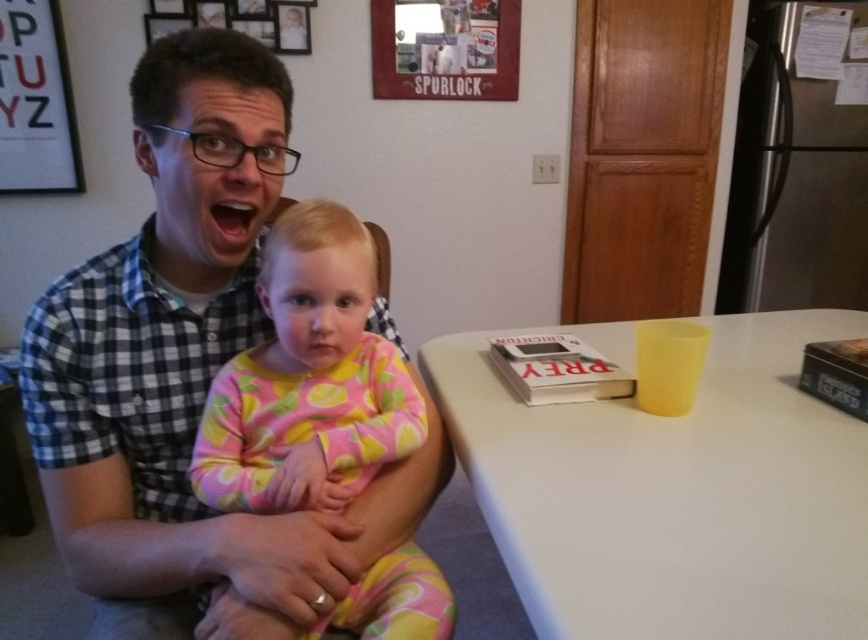
This screenshot has height=640, width=868. What do you see at coordinates (672, 490) in the screenshot? I see `white matte table at center` at bounding box center [672, 490].

Does point (540, 449) come in front of point (217, 440)?

No, (540, 449) is behind (217, 440).

Where is `white matte table at center`? This screenshot has width=868, height=640. white matte table at center is located at coordinates (672, 490).

Who is higher up, checkered fabric shirt at upper left or pink floral pajamas at center?

checkered fabric shirt at upper left

You are a GUI agent. You are given a task and a screenshot of the screen. Output one action in this format:
    pyautogui.click(x=<x>, y=<y>)
    Task: Click on the checkered fabric shirt at upper left
    This screenshot has width=868, height=640.
    Given the screenshot: What is the action you would take?
    pyautogui.click(x=188, y=376)

Is point (169, 563) in front of point (579, 456)?

Yes, it is in front of point (579, 456).

Who is shorter, checkered fabric shirt at upper left or white matte table at center?

white matte table at center

The width and height of the screenshot is (868, 640). Find the location of `checkered fabric shirt at upper left`. checkered fabric shirt at upper left is located at coordinates (188, 376).